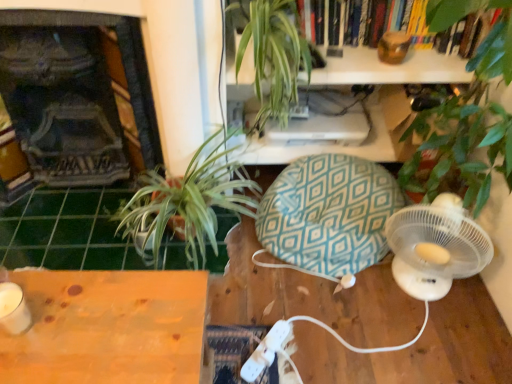
Locate an element on the screen. This screenshot has height=384, width=512. vacant area on top of green tile at lower left (from a real-world perspective) is located at coordinates (66, 226).